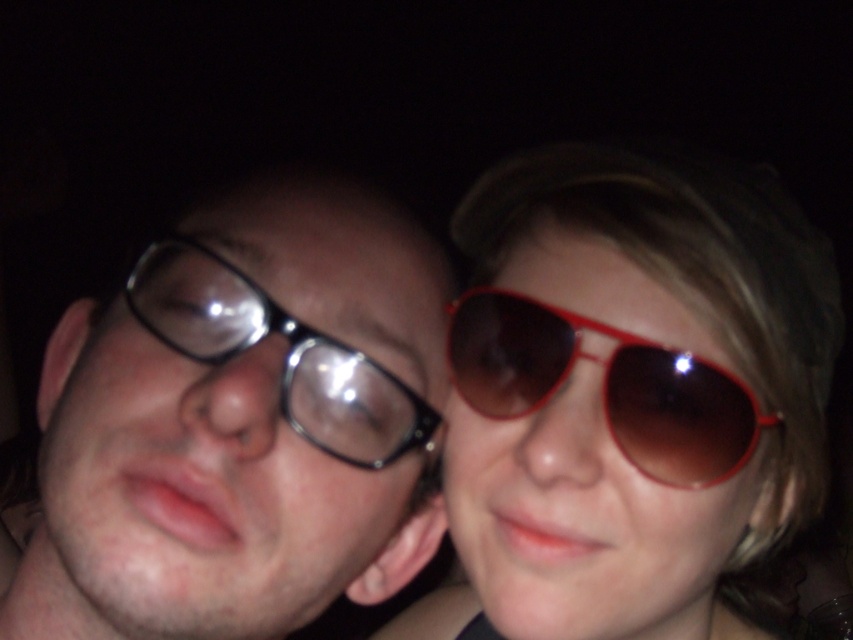
You are a photographer who wants to focus on the matte black glasses at left and the black plastic glasses at left in the image. Which of these glasses is positioned closer to the camera?

The matte black glasses at left is closer to the viewer than the black plastic glasses at left, so the matte black glasses at left is positioned closer to the camera.

You are a photographer adjusting the lighting for a portrait. You notice the matte red sunglasses at upper right and the matte black glasses at left. Which eyewear is closer to you, and how might this affect their reflection visibility?

The matte red sunglasses at upper right is closer to you than the matte black glasses at left. Since it is closer, its reflection might appear more prominent or brighter due to the light source proximity.